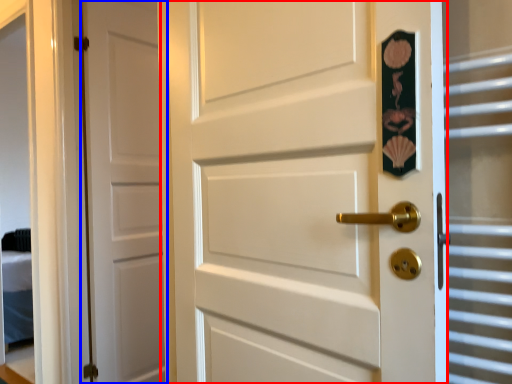
Question: Which object is closer to the camera taking this photo, door (highlighted by a red box) or door (highlighted by a blue box)?

Choices:
 (A) door
 (B) door

Answer: (A)